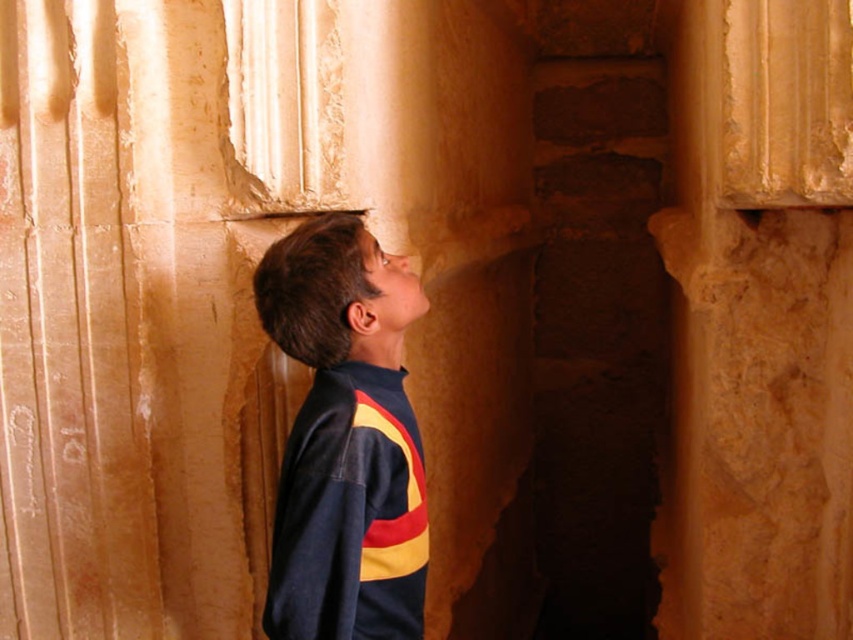
Which is more to the right, smooth stone column at center or dark blue fleece at center?

From the viewer's perspective, smooth stone column at center appears more on the right side.

Does smooth stone column at center have a lesser width compared to dark blue fleece at center?

Incorrect, smooth stone column at center's width is not less than dark blue fleece at center's.

Identify the location of smooth stone column at center. The image size is (853, 640). (759, 321).